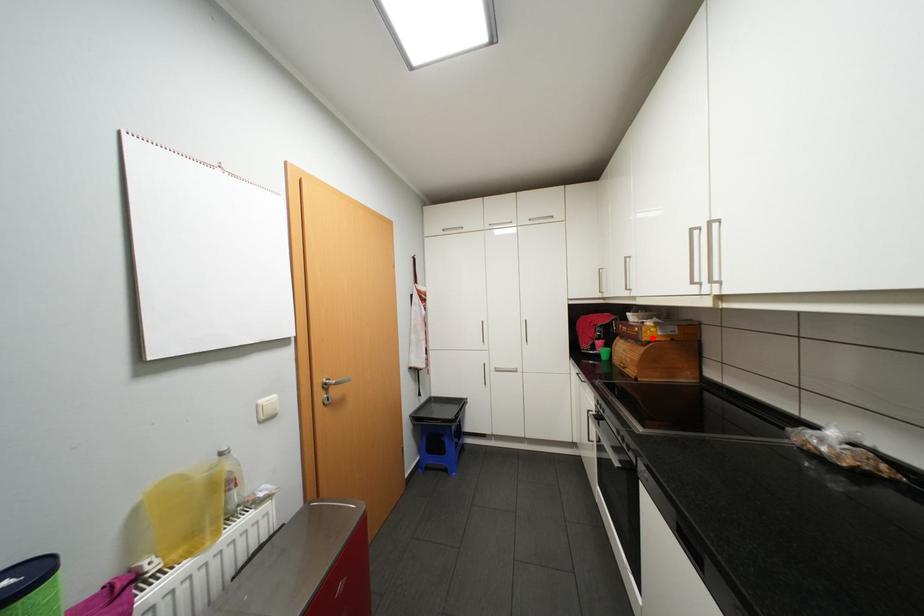
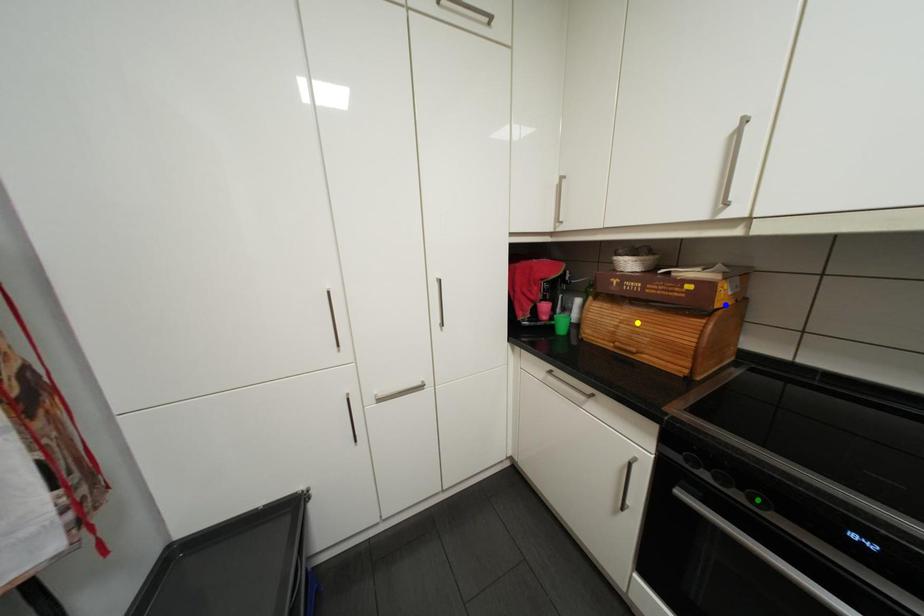
Question: I am providing you with two images of the same scene from different viewpoints. A red point is marked on the first image. You are given multiple points on the second image. Which mark in image 2 goes with the point in image 1?

Choices:
 (A) green point
 (B) yellow point
 (C) blue point

Answer: (C)